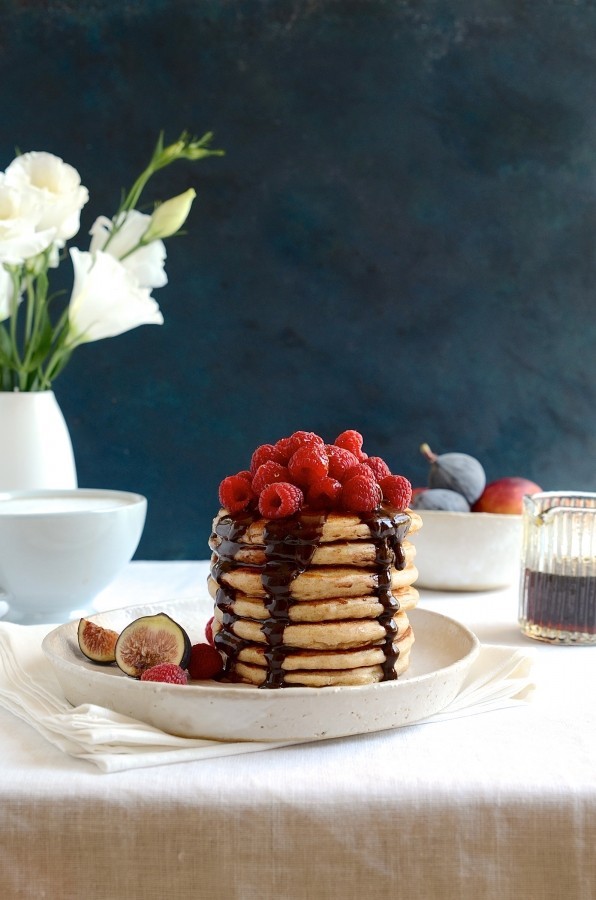
At what (x,y) coordinates should I click in order to perform the action: click on bowl. Please return your answer as a coordinate pair (x, y). Image resolution: width=596 pixels, height=900 pixels. Looking at the image, I should click on (54, 540), (473, 526).